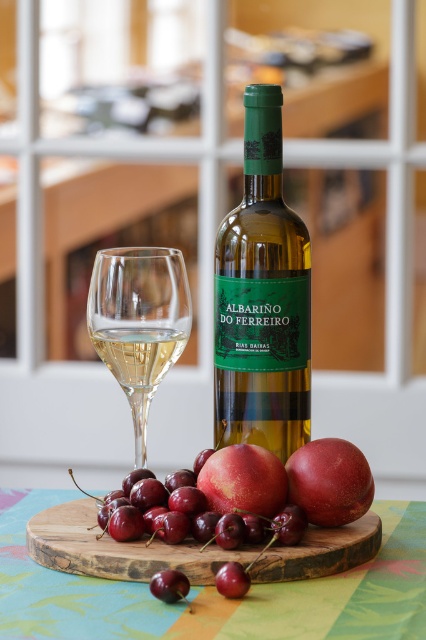
Which is above, clear glass wine glass at center or glossy red apple at center?

clear glass wine glass at center is higher up.

Which is behind, point (108, 292) or point (325, 444)?

The point (108, 292) is more distant.

The height and width of the screenshot is (640, 426). Describe the element at coordinates (138, 323) in the screenshot. I see `clear glass wine glass at center` at that location.

Locate an element on the screen. The image size is (426, 640). clear glass wine glass at center is located at coordinates (138, 323).

Who is more forward, (253, 330) or (342, 524)?

Positioned in front is point (342, 524).

Who is positioned more to the right, green glass bottle at center or glossy red apple at center?

glossy red apple at center

Is point (230, 218) positioned after point (356, 497)?

Yes, it is.

Locate an element on the screen. The height and width of the screenshot is (640, 426). green glass bottle at center is located at coordinates (261, 298).

Describe the element at coordinates (118, 548) in the screenshot. I see `wooden at center` at that location.

The height and width of the screenshot is (640, 426). Identify the location of wooden at center. (118, 548).

Where is `wooden at center`? wooden at center is located at coordinates (118, 548).